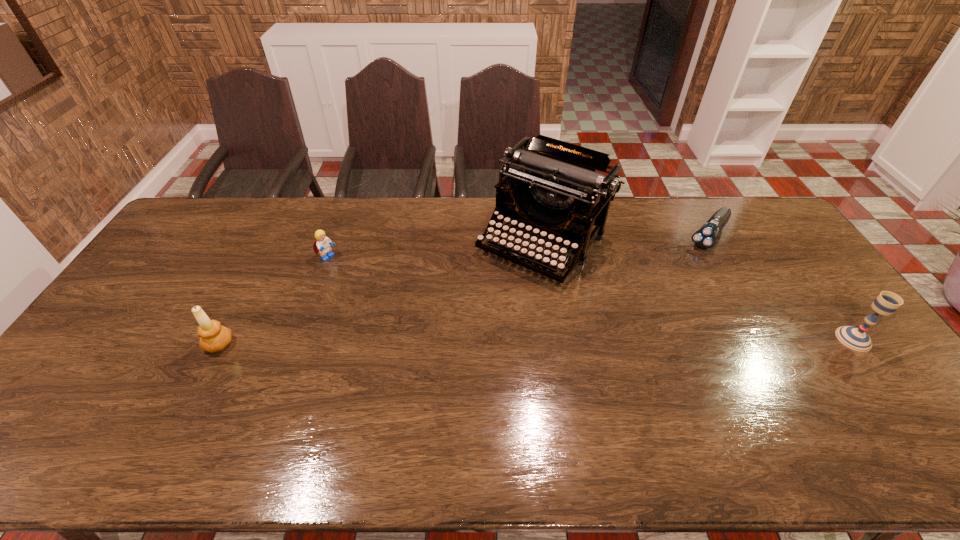
The height and width of the screenshot is (540, 960). What are the coordinates of `free space on the desktop that is between the candle_holder and the rightmost object and is positioned on the front-facing side of the second shortest object` in the screenshot? It's located at (483, 342).

The height and width of the screenshot is (540, 960). Identify the location of free spot on the desktop that is between the candle_holder and the rightmost object and is positioned on the typing side of the tallest object. (461, 342).

In order to click on vacant space on the desktop that is between the candle_holder and the rightmost object and is positioned on the head of the shortest object in this screenshot , I will do `click(625, 341)`.